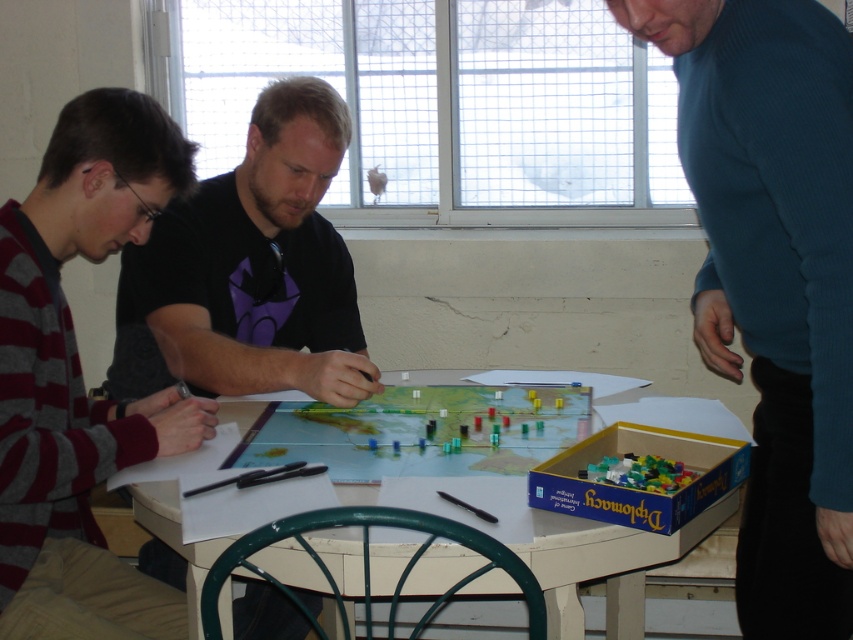
Question: Estimate the real-world distances between objects in this image. Which object is farther from the translucent plastic lego pieces at lower right?

Choices:
 (A) white glossy table at center
 (B) striped sweater at left

Answer: (B)

Question: Among these objects, which one is farthest from the camera?

Choices:
 (A) translucent plastic lego pieces at lower right
 (B) striped sweater at left
 (C) dark blue sweater at right
 (D) wooden map at center

Answer: (D)

Question: Estimate the real-world distances between objects in this image. Which object is closer to the white glossy table at center?

Choices:
 (A) striped sweater at left
 (B) wooden map at center
 (C) dark blue sweater at right
 (D) translucent plastic lego pieces at lower right

Answer: (B)

Question: Can you confirm if white glossy table at center is smaller than wooden map at center?

Choices:
 (A) yes
 (B) no

Answer: (B)

Question: Does dark blue sweater at right appear on the right side of wooden map at center?

Choices:
 (A) no
 (B) yes

Answer: (B)

Question: Does striped sweater at left appear under translucent plastic lego pieces at lower right?

Choices:
 (A) no
 (B) yes

Answer: (A)